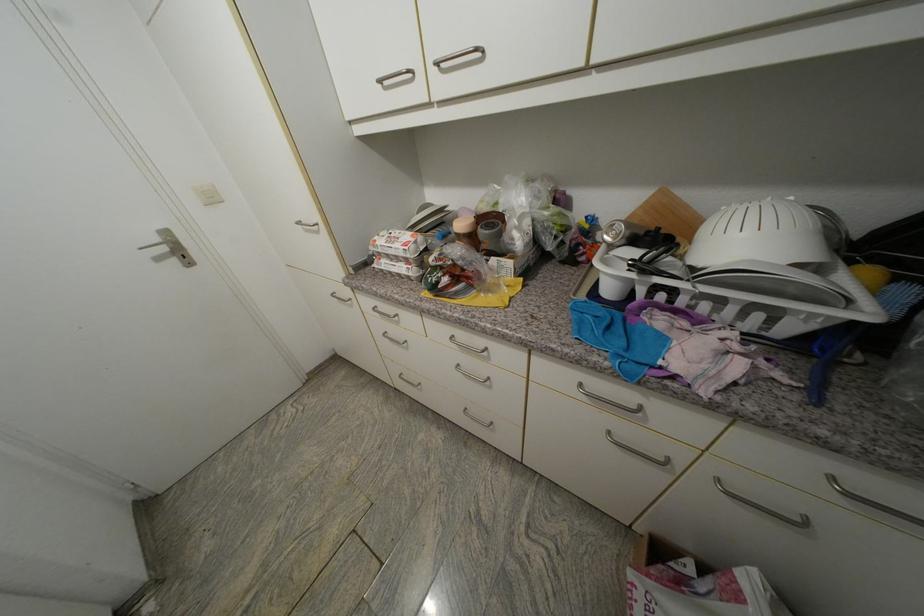
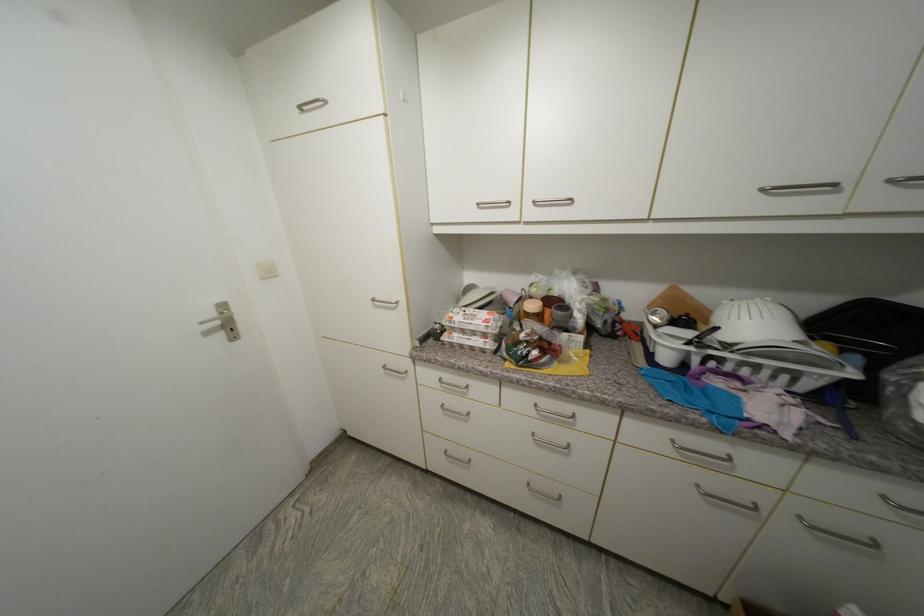
Find the pixel in the second image that matches pixel 164 243 in the first image.

(220, 315)